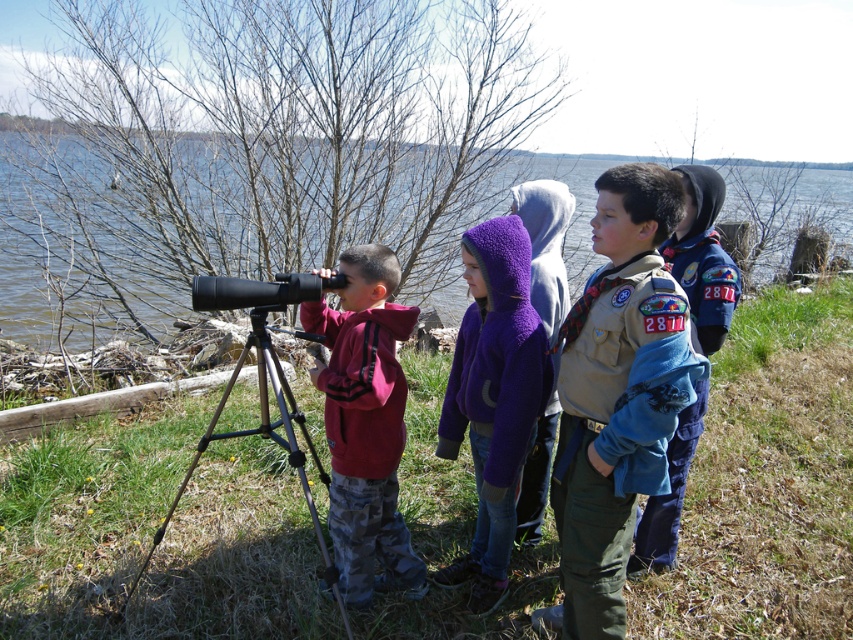
You are a photographer trying to capture a wide shot of the scene. The camera you are using has a maximum width capacity of 2 meters. Given the clear blue water at center and the blue fleece jacket at center, which object will fit entirely within the camera frame?

The clear blue water at center will fit entirely within the camera frame because its width is larger than the blue fleece jacket at center, so the camera can accommodate its width of 2 meters.

Looking at this image, you are a photographer planning to take a wide shot of the scene. The camera you are using has a maximum width capacity of 3 meters. Given that the clear blue water at center and the black metal tripod at lower left are in the frame, will the camera be able to capture both objects without cropping?

The clear blue water at center is wider than the black metal tripod at lower left. Since the camera can capture up to 3 meters, and the combined width of both objects is within this limit, the camera should be able to capture both without cropping.

You are standing at the position of point (683, 232) and want to move to the lake edge. There is an obstacle at point (132, 330). Can you walk directly towards the lake without going around the obstacle?

Point (132, 330) is behind point (683, 232), so you can walk directly towards the lake without going around the obstacle.